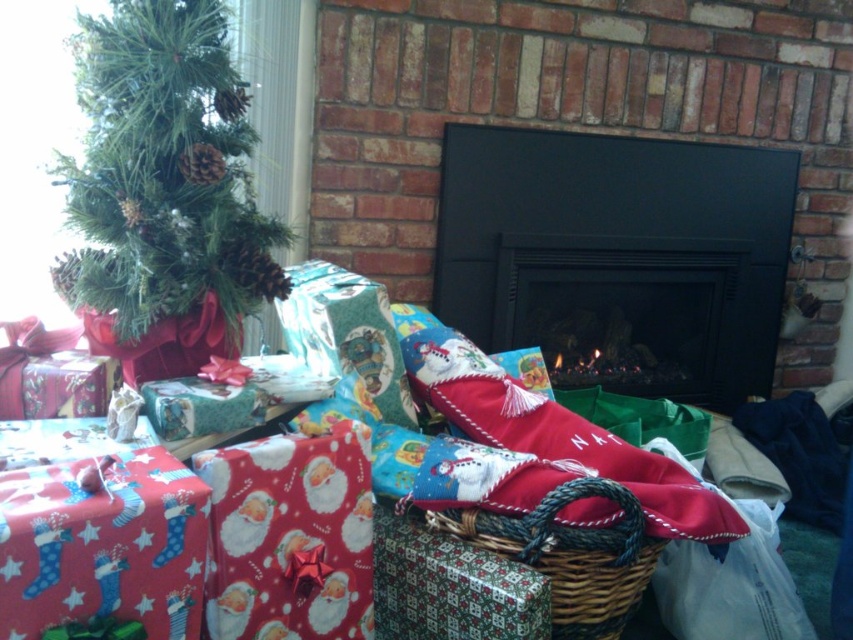
Is black matte fireplace at center behind red matte wrapping paper at lower left?

Yes, it is.

Is black matte fireplace at center below red matte wrapping paper at lower left?

No.

Image resolution: width=853 pixels, height=640 pixels. Identify the location of black matte fireplace at center. (618, 257).

Image resolution: width=853 pixels, height=640 pixels. What are the coordinates of `black matte fireplace at center` in the screenshot? It's located at (618, 257).

Is green matte christmas tree at upper left taller than santa-themed fabric stocking at center?

Yes, green matte christmas tree at upper left is taller than santa-themed fabric stocking at center.

Between point (190, 166) and point (480, 369), which one is positioned in front?

Point (190, 166)

Between point (108, 161) and point (463, 390), which one is positioned behind?

Point (463, 390)

Locate an element on the screen. This screenshot has width=853, height=640. green matte christmas tree at upper left is located at coordinates (164, 172).

Between black matte fireplace at center and santa-themed fabric stocking at center, which one has more height?

black matte fireplace at center

Does black matte fireplace at center have a smaller size compared to santa-themed fabric stocking at center?

No, black matte fireplace at center is not smaller than santa-themed fabric stocking at center.

Locate an element on the screen. This screenshot has width=853, height=640. black matte fireplace at center is located at coordinates [618, 257].